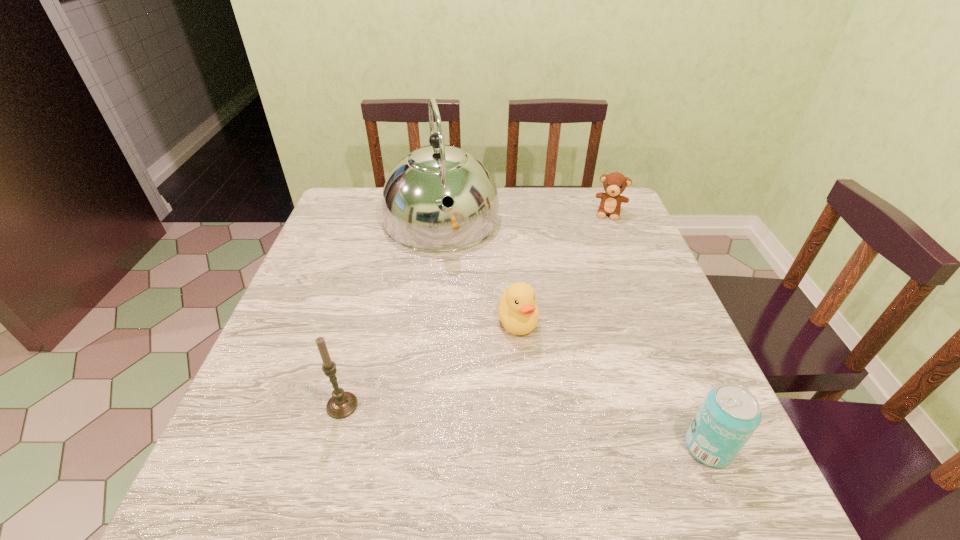
Locate an element on the screen. This screenshot has width=960, height=540. free space at the near left corner of the desktop is located at coordinates coord(258,412).

I want to click on empty location between the nearest object and the kettle, so [575, 334].

Where is `unoccupied position between the tallest object and the duckling`? unoccupied position between the tallest object and the duckling is located at coordinates (480, 271).

You are a GUI agent. You are given a task and a screenshot of the screen. Output one action in this format:
    pyautogui.click(x=<x>, y=<y>)
    Task: Click on the vacant area that lies between the teddy bear and the third farthest object
    Image resolution: width=960 pixels, height=540 pixels.
    Given the screenshot: What is the action you would take?
    pyautogui.click(x=564, y=267)

Locate an element on the screen. This screenshot has width=960, height=540. unoccupied area between the teddy bear and the duckling is located at coordinates (564, 267).

Where is `vacant area that lies between the tallest object and the candle`? The image size is (960, 540). vacant area that lies between the tallest object and the candle is located at coordinates (392, 313).

Identify the location of vacant area between the kettle and the teddy bear. The height and width of the screenshot is (540, 960). (525, 217).

Where is `vacant space that's between the nearest object and the teddy bear`? vacant space that's between the nearest object and the teddy bear is located at coordinates (660, 330).

Find the location of a particular element. The height and width of the screenshot is (540, 960). empty location between the duckling and the tallest object is located at coordinates (480, 271).

Where is `vacant area that lies between the candle and the nearest object`? The width and height of the screenshot is (960, 540). vacant area that lies between the candle and the nearest object is located at coordinates (525, 426).